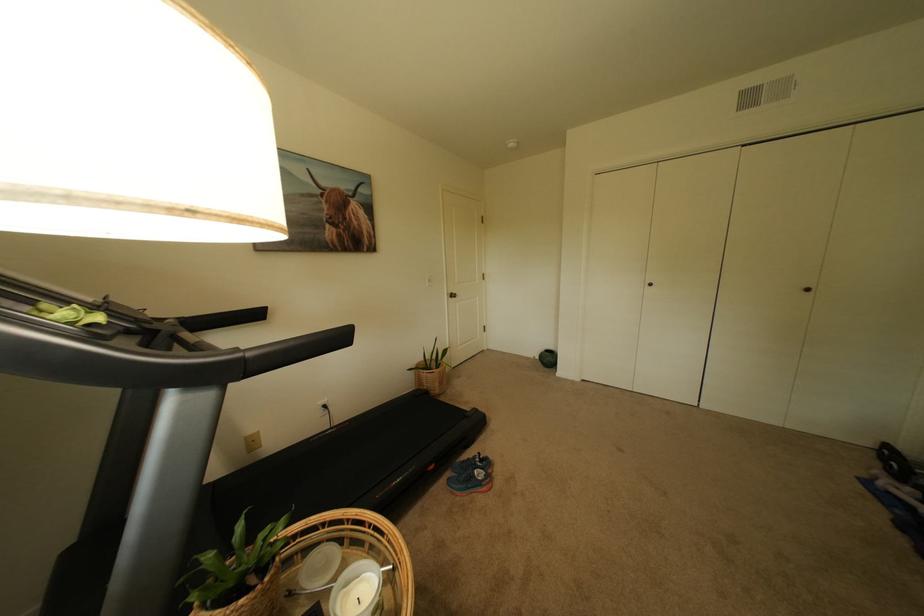
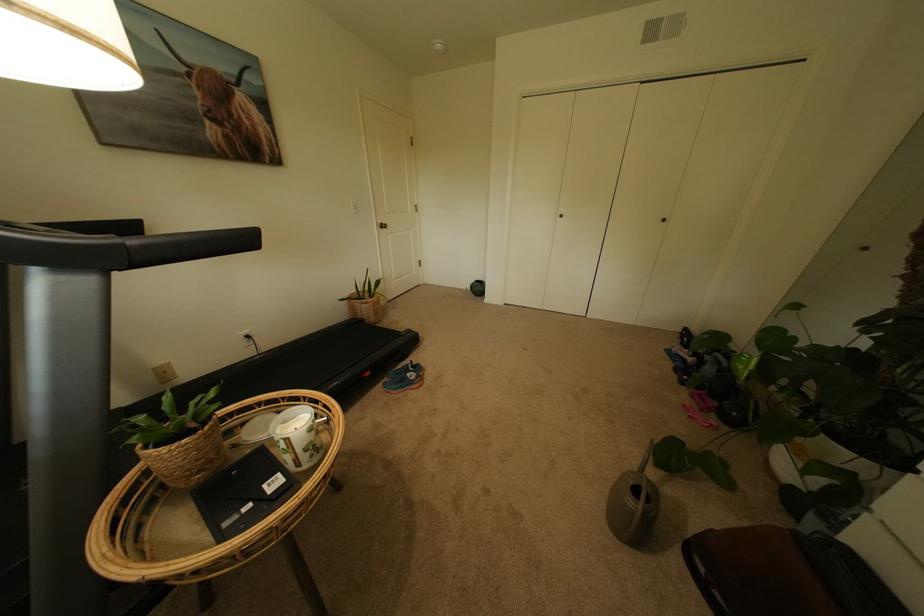
Where in the second image is the point corresponding to (541,358) from the first image?

(473, 289)